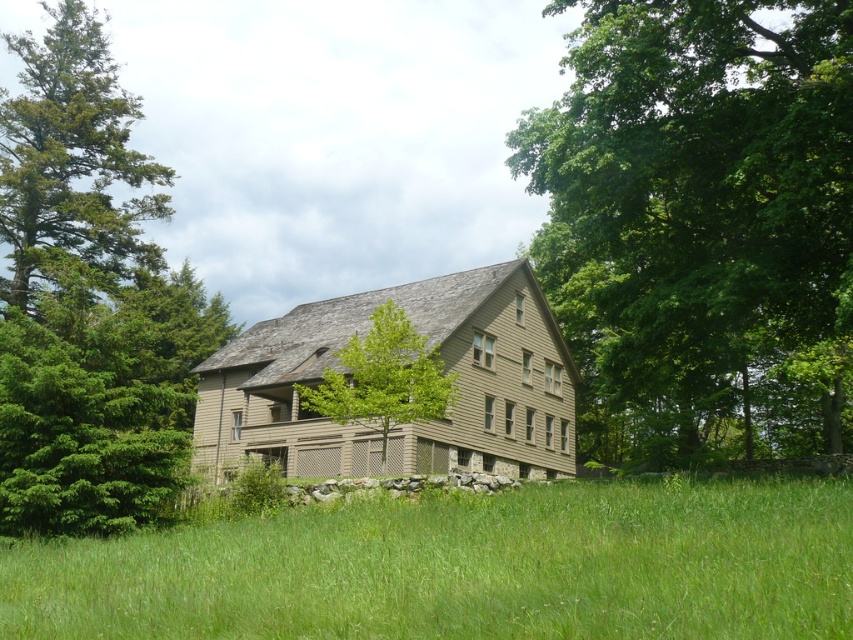
You are standing in front of the two story house and want to walk from the green grass at lower center to the green leafy tree at upper right. Which direction should you move to reach the tree?

The green grass at lower center is behind the green leafy tree at upper right, so to reach the tree, you should move forward towards the tree from behind it. However, since you are already in front of the house, the tree is at the upper right, so you might need to move towards the right and upwards, but since you can only move on the ground, moving towards the right direction from the grass at lower center would lead you toward the green leafy tree at upper right.

You are standing in front of the two story house and want to know where the green leafy tree at upper right is located relative to the house. Can you determine its position based on the coordinates provided?

The green leafy tree at upper right is located at point (701,227), which places it in the upper right area of the image, near the top right corner of the house.

You are standing in front of the house and want to know which tree has a larger width. Which one is wider between the green coniferous tree at left and the green leafy tree at center?

The green coniferous tree at left might be wider than green leafy tree at center.